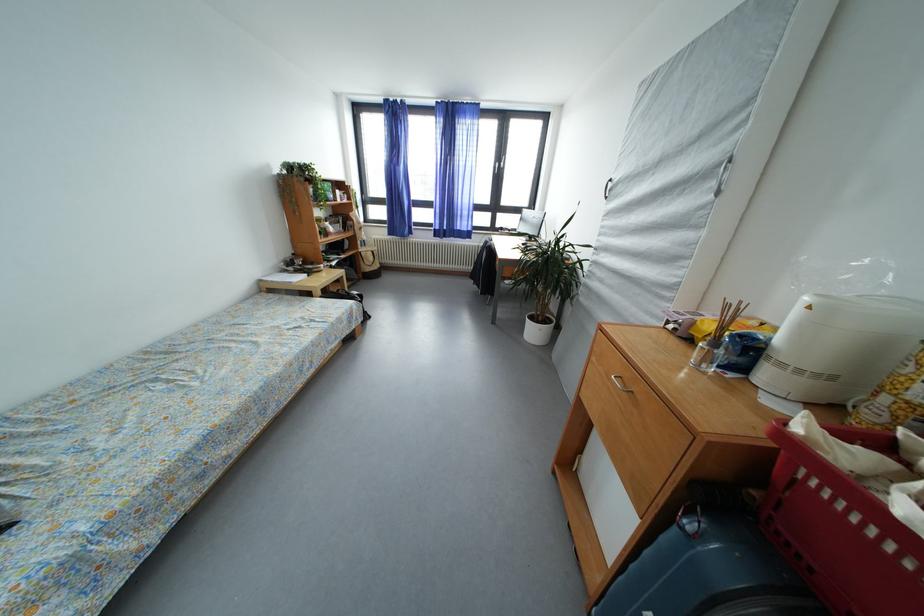
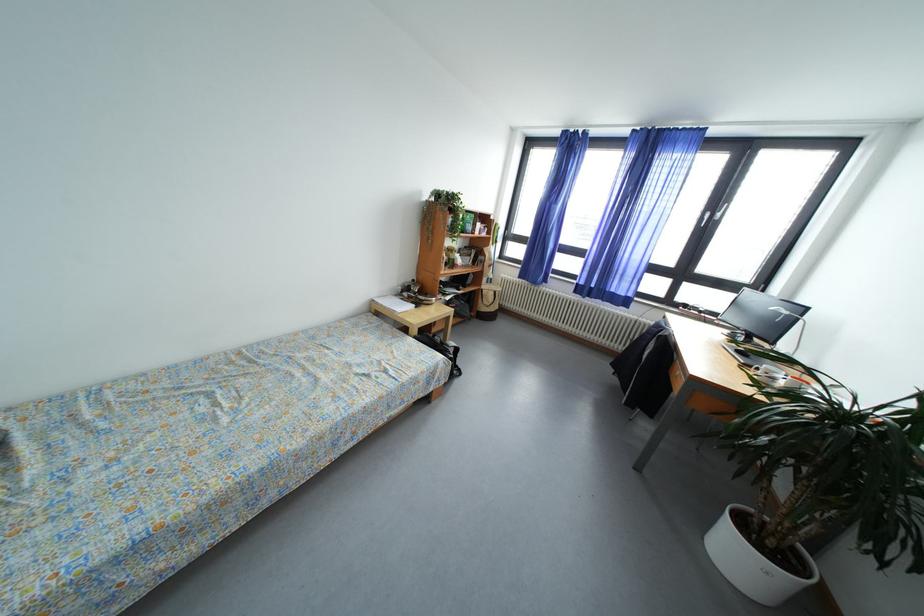
Locate, in the second image, the point that corresponds to point 540,337 in the first image.

(745, 561)